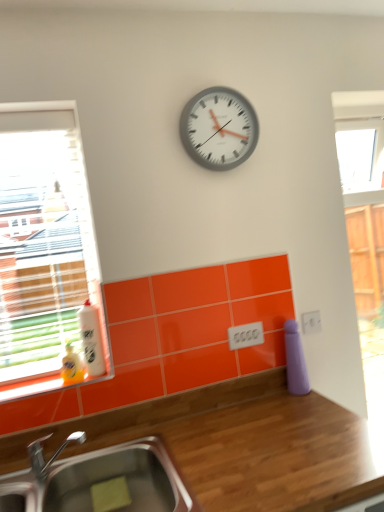
Identify the location of vacant space underneath clear glass window at left (from a real-world perspective). The image size is (384, 512). (29, 370).